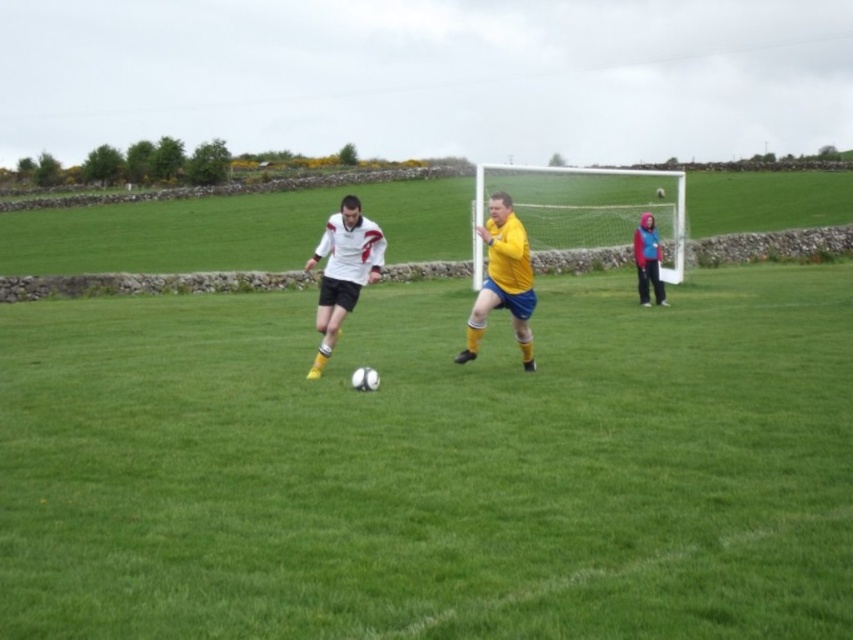
You are a soccer referee observing the game. You need to determine if the players are within the required 2 meters distance for a fair play. Are the white matte jersey at center and yellow matte jersey at center within the distance?

The white matte jersey at center is 1.87 meters from yellow matte jersey at center, which is within the required 2 meters distance for fair play.

You are a soccer player positioned at the center of the field. You see the white mesh net at center represented by point (x=589, y=212). If you want to score a goal, which direction should you kick the ball?

The white mesh net at center is located at point (x=589, y=212), so you should kick the ball towards that point to score a goal.